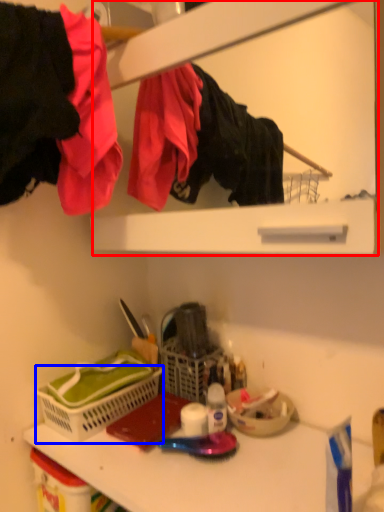
Question: Which object is closer to the camera taking this photo, medicine cabinet (highlighted by a red box) or basket (highlighted by a blue box)?

Choices:
 (A) medicine cabinet
 (B) basket

Answer: (A)